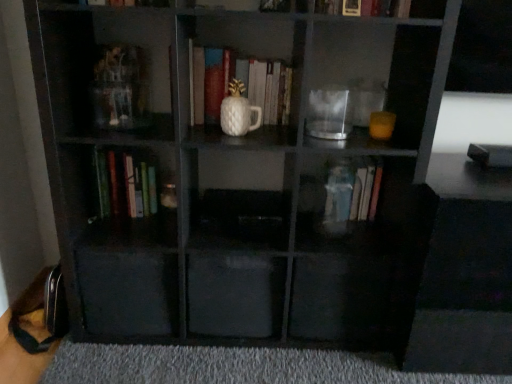
This screenshot has height=384, width=512. I want to click on free location above green matte book at lower left, the first book viewed from the left (from a real-world perspective), so click(123, 138).